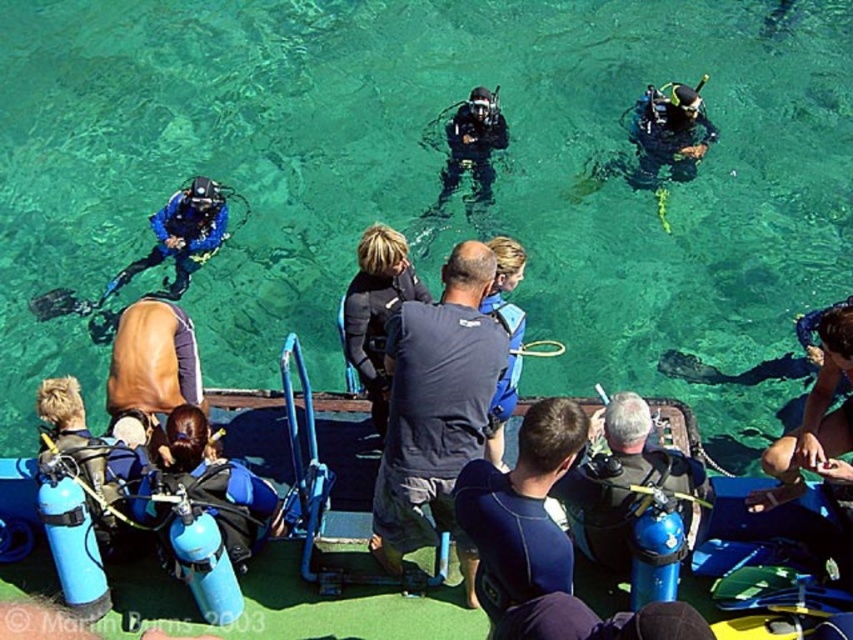
Which is more to the left, clear water at lower center or blue rubber boat at lower center?

clear water at lower center is more to the left.

The height and width of the screenshot is (640, 853). I want to click on clear water at lower center, so click(x=428, y=177).

Describe the element at coordinates (428, 177) in the screenshot. Image resolution: width=853 pixels, height=640 pixels. I see `clear water at lower center` at that location.

Is clear water at lower center positioned at the back of dark blue fabric at center?

Yes.

Where is `clear water at lower center`? The width and height of the screenshot is (853, 640). clear water at lower center is located at coordinates (428, 177).

Between point (368, 108) and point (503, 141), which one is positioned in front?

Point (503, 141)

Can you confirm if clear water at lower center is positioned to the left of black matte wetsuit at center?

Indeed, clear water at lower center is positioned on the left side of black matte wetsuit at center.

This screenshot has width=853, height=640. What are the coordinates of `clear water at lower center` in the screenshot? It's located at (428, 177).

You are a GUI agent. You are given a task and a screenshot of the screen. Output one action in this format:
    pyautogui.click(x=<x>, y=<y>)
    Task: Click on the clear water at lower center
    The width and height of the screenshot is (853, 640).
    Given the screenshot: What is the action you would take?
    pyautogui.click(x=428, y=177)